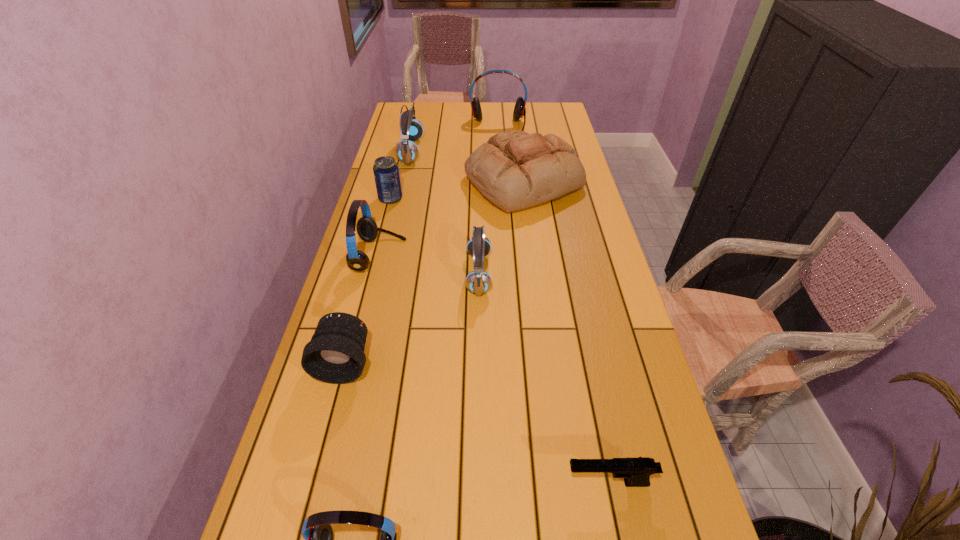
Identify which red headset is the second closest to the black telephoto lens. Please provide its 2D coordinates. Your answer should be formatted as a tuple, i.e. [(x, y)], where the tuple contains the x and y coordinates of a point satisfying the conditions above.

[(318, 534)]

The height and width of the screenshot is (540, 960). I want to click on the second closest blue headset relative to the second nearest object, so click(406, 151).

At what (x,y) coordinates should I click in order to perform the action: click on blue headset that stands as the closest to the shortest object. Please return your answer as a coordinate pair (x, y). The height and width of the screenshot is (540, 960). Looking at the image, I should click on (478, 281).

Locate an element on the screen. free space that satisfies the following two spatial constraints: 1. with the microphone attached to the side of the tallest headset; 2. on the ear cups of the nearer blue headset is located at coordinates (508, 274).

You are a GUI agent. You are given a task and a screenshot of the screen. Output one action in this format:
    pyautogui.click(x=<x>, y=<y>)
    Task: Click on the free space that satisfies the following two spatial constraints: 1. on the ear cups of the farther blue headset; 2. at the front element of the seventh farthest object
    This screenshot has height=540, width=960.
    Given the screenshot: What is the action you would take?
    pyautogui.click(x=363, y=362)

Identify the location of vacant position in the image that satisfies the following two spatial constraints: 1. on the ear cups of the left blue headset; 2. on the back side of the bread. (404, 183).